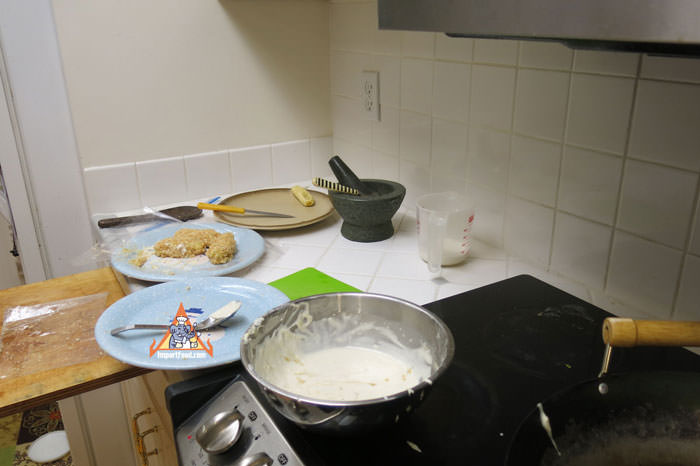
Locate an element on the screen. The width and height of the screenshot is (700, 466). knob is located at coordinates (218, 433).